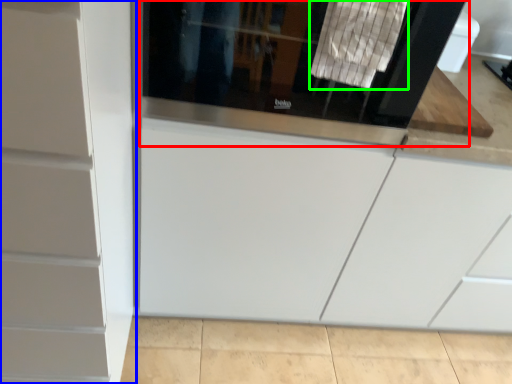
Question: Estimate the real-world distances between objects in this image. Which object is closer to screen door (highlighted by a red box), cabinetry (highlighted by a blue box) or laundry (highlighted by a green box)?

Choices:
 (A) cabinetry
 (B) laundry

Answer: (B)